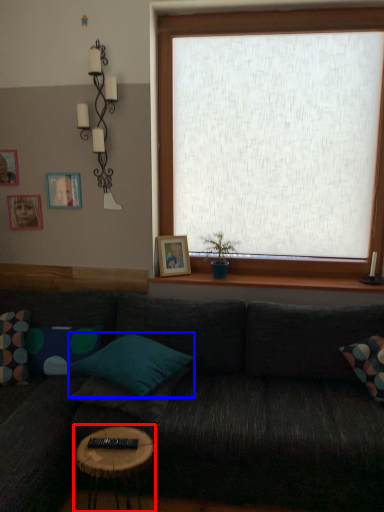
Question: Among these objects, which one is nearest to the camera, table (highlighted by a red box) or pillow (highlighted by a blue box)?

Choices:
 (A) table
 (B) pillow

Answer: (A)